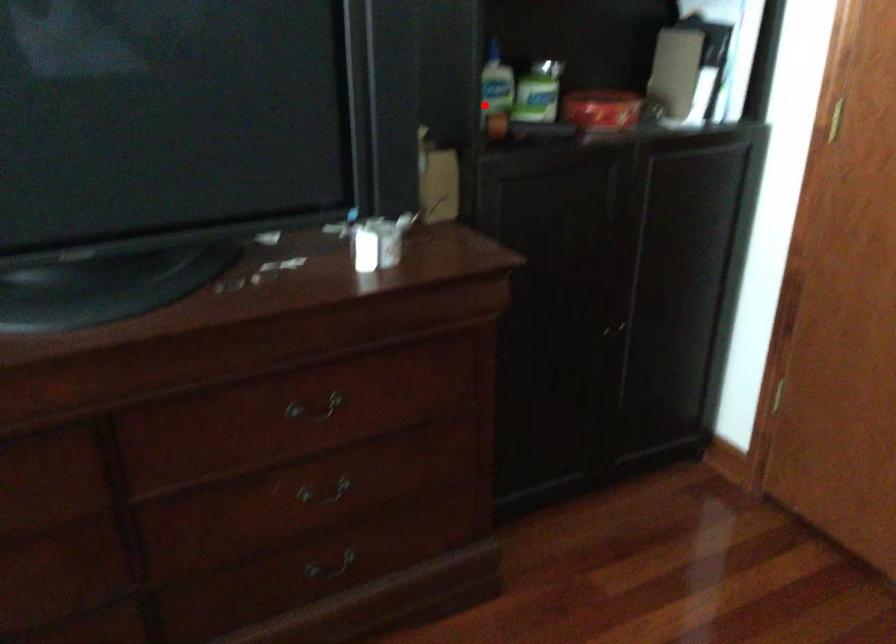
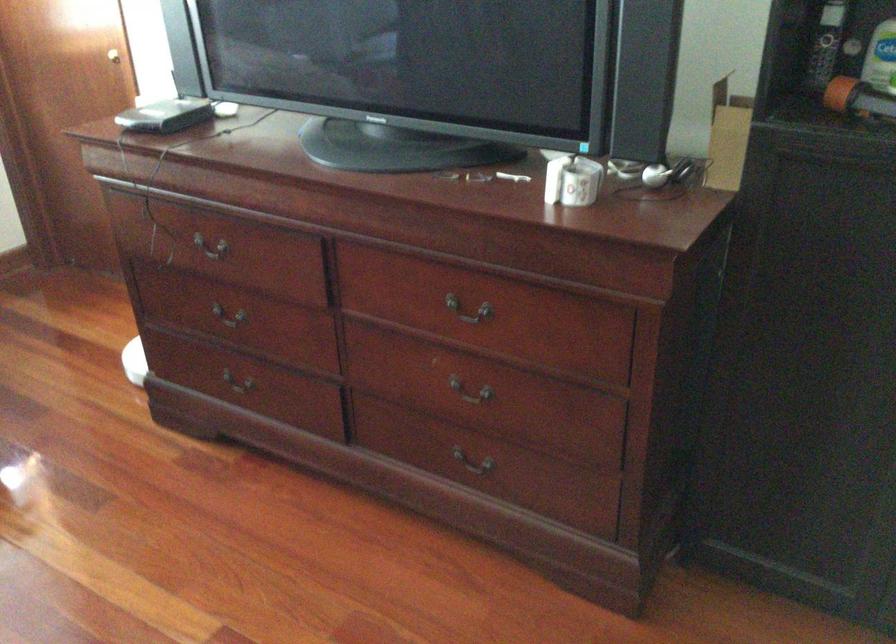
In the second image, find the point that corresponds to the highlighted location in the first image.

(883, 77)